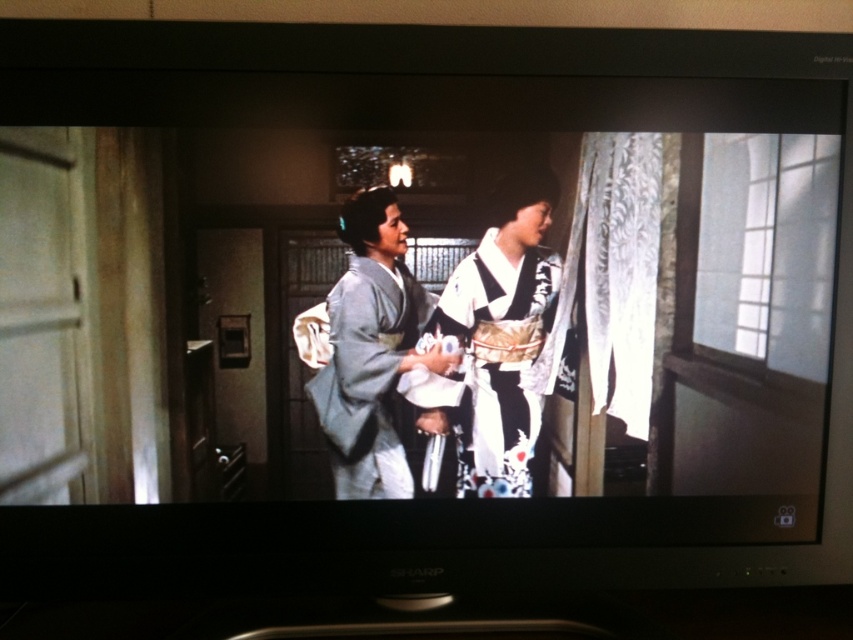
You are an assistant in a traditional Japanese shop. You see two kimonos displayed in the center of the room. The white silk kimono at center and the light gray silk kimono at center. Which kimono is positioned to the right of the other?

A: The white silk kimono at center is to the right of the light gray silk kimono at center.

You are an assistant analyzing the scene from the traditional Japanese house. The white silk kimono at center is part of the image. Can you determine its exact position using coordinates?

The white silk kimono at center is located at point (491, 360).

You are a costume designer preparing for a play and need to ensure that the two kimonos in the image will fit through a narrow doorway. The white silk kimono at center and the light gray silk kimono at center are both at center. Given that the doorway is only slightly wider than the narrower kimono, which kimono might have difficulty passing through?

The white silk kimono at center has a larger width than the light gray silk kimono at center, so it might have difficulty passing through the narrow doorway since it is wider than the other.